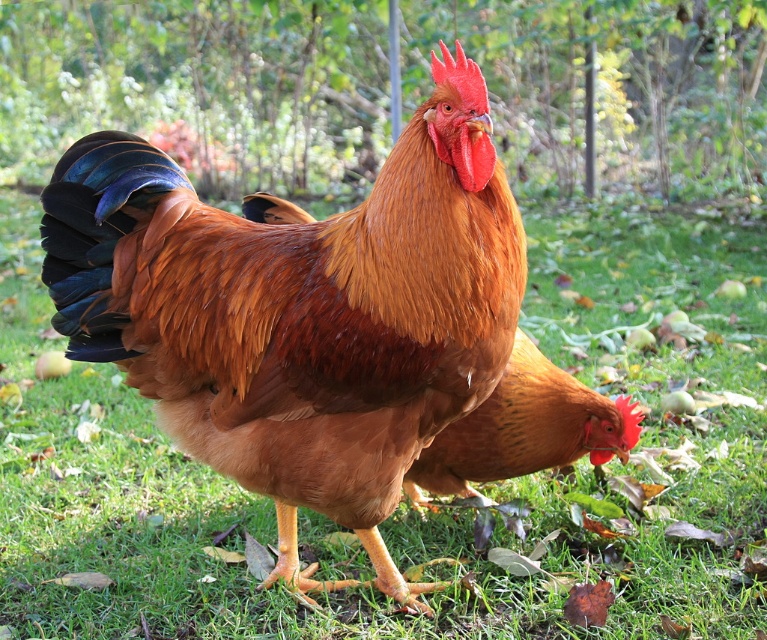
Between shiny brown rooster at center and brown feathered chicken at center, which one appears on the left side from the viewer's perspective?

shiny brown rooster at center

Is point (364, 304) positioned in front of point (519, 472)?

Yes, point (364, 304) is in front of point (519, 472).

Where is `shiny brown rooster at center`? shiny brown rooster at center is located at coordinates (300, 314).